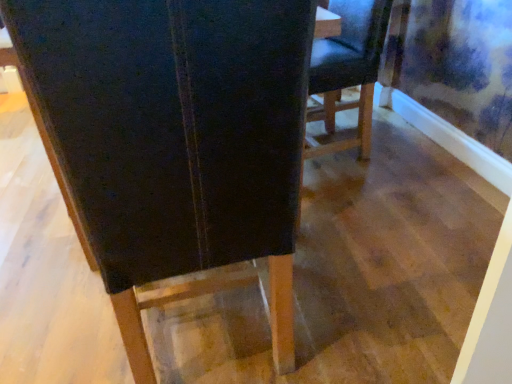
The width and height of the screenshot is (512, 384). I want to click on free spot in front of matte black chair at center, which is counted as the 2th chair, starting from the left, so click(x=364, y=180).